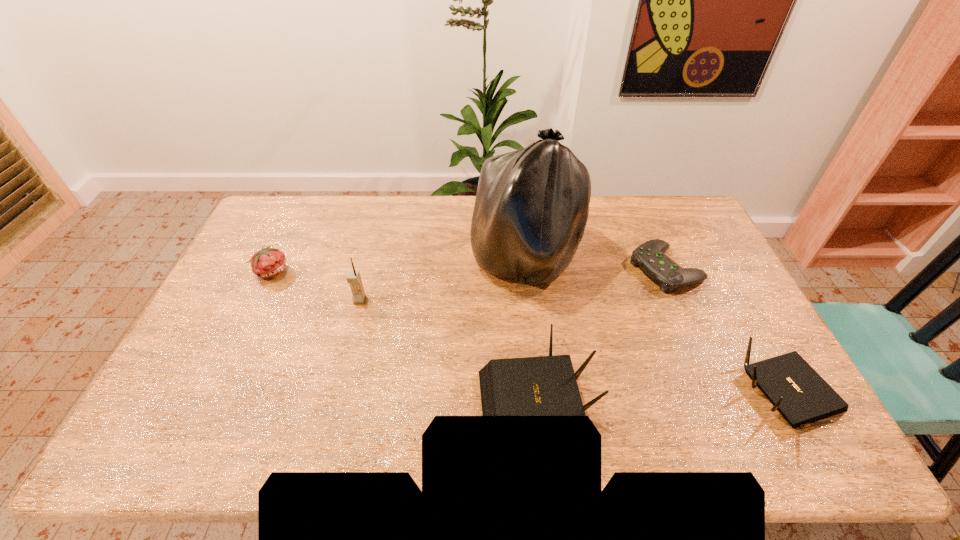
Identify the location of object that is at the near right corner. (796, 390).

Find the location of a particular element. This screenshot has width=960, height=540. vacant space at the far edge of the desktop is located at coordinates (328, 222).

Locate an element on the screen. vacant space at the near edge is located at coordinates (444, 392).

Find the location of a particular element. The image size is (960, 540). vacant region at the left edge of the desktop is located at coordinates (202, 341).

The width and height of the screenshot is (960, 540). What are the coordinates of `vacant space at the right edge of the desktop` in the screenshot? It's located at (744, 367).

Image resolution: width=960 pixels, height=540 pixels. In the image, there is a desktop. Find the location of `blank space at the far left corner`. blank space at the far left corner is located at coordinates (300, 206).

The image size is (960, 540). I want to click on vacant space at the far right corner of the desktop, so click(x=669, y=220).

This screenshot has height=540, width=960. Find the location of `blank region between the shorter router and the second shortest object`. blank region between the shorter router and the second shortest object is located at coordinates (531, 334).

I want to click on vacant space that's between the plastic bag and the third shortest object, so click(658, 328).

Locate an element on the screen. This screenshot has width=960, height=540. free space between the taller router and the third shortest object is located at coordinates point(663,400).